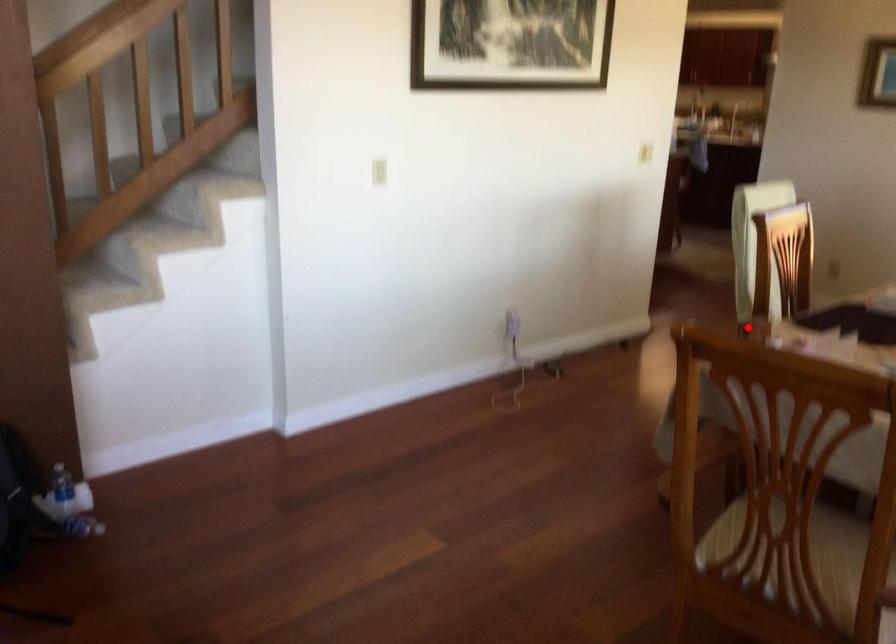
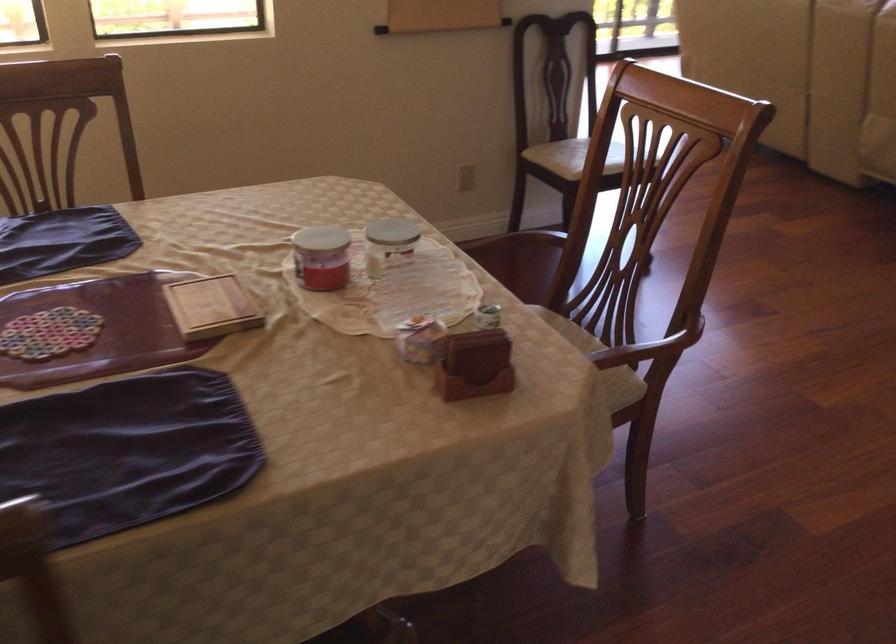
Question: I am providing you with two images of the same scene from different viewpoints. In image1, a red point is highlighted. Considering the same 3D point in image2, which of the following is correct?

Choices:
 (A) It is closer
 (B) It is farther

Answer: (A)